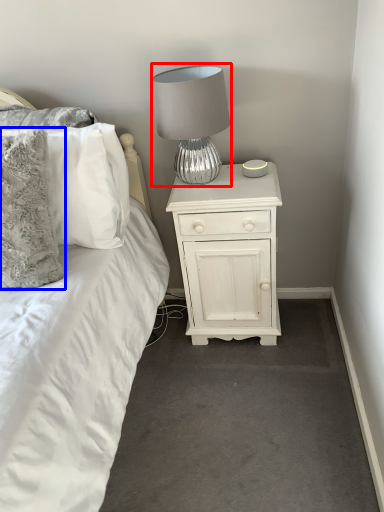
Question: Which object is further to the camera taking this photo, lamp (highlighted by a red box) or pillow (highlighted by a blue box)?

Choices:
 (A) lamp
 (B) pillow

Answer: (A)